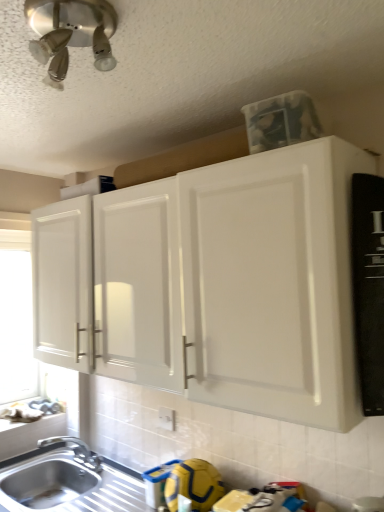
Describe the element at coordinates (166, 418) in the screenshot. The height and width of the screenshot is (512, 384). I see `white plastic electric outlet at lower center` at that location.

Where is `white matte window screen at left`? This screenshot has width=384, height=512. white matte window screen at left is located at coordinates (16, 320).

Find the location of `silver metallic faucet at lower left`. silver metallic faucet at lower left is located at coordinates (74, 449).

Image resolution: width=384 pixels, height=512 pixels. Describe the element at coordinates (212, 284) in the screenshot. I see `white matte cabinet at upper center` at that location.

Identify the location of white matte window sill at lower left. This screenshot has width=384, height=512. (36, 426).

Looking at this image, is white matte window sill at lower left oriented towards white matte window screen at left?

No, white matte window sill at lower left is not aimed at white matte window screen at left.

From the image's perspective, is white matte window sill at lower left on white matte window screen at left?

No, from the image's perspective, white matte window sill at lower left is not on top of white matte window screen at left.

How far apart are white matte window sill at lower left and white matte window screen at left?

32.33 inches.

Identify the location of window screen that appears on the left of white matte window sill at lower left. Image resolution: width=384 pixels, height=512 pixels. (16, 320).

From a real-world perspective, is white matte window sill at lower left over white plastic electric outlet at lower center?

No.

Are white matte window sill at lower left and white plastic electric outlet at lower center far apart?

white matte window sill at lower left is actually quite close to white plastic electric outlet at lower center.

Is stainless steel sink at lower left not near white plastic electric outlet at lower center?

No, there isn't a large distance between stainless steel sink at lower left and white plastic electric outlet at lower center.

Considering the sizes of objects stainless steel sink at lower left and white plastic electric outlet at lower center in the image provided, who is bigger, stainless steel sink at lower left or white plastic electric outlet at lower center?

stainless steel sink at lower left.

Could you tell me if stainless steel sink at lower left is turned towards white plastic electric outlet at lower center?

No, stainless steel sink at lower left is not facing towards white plastic electric outlet at lower center.

From the image's perspective, is stainless steel sink at lower left located above or below white plastic electric outlet at lower center?

From the image's perspective, stainless steel sink at lower left appears below white plastic electric outlet at lower center.

Which object is thinner, white matte window sill at lower left or silver metallic faucet at lower left?

white matte window sill at lower left.

Identify the location of window sill above the silver metallic faucet at lower left (from the image's perspective). Image resolution: width=384 pixels, height=512 pixels. (36, 426).

Could you tell me if white matte window sill at lower left is facing silver metallic faucet at lower left?

Yes, white matte window sill at lower left is facing silver metallic faucet at lower left.

Does white matte window sill at lower left appear on the right side of silver metallic faucet at lower left?

In fact, white matte window sill at lower left is to the left of silver metallic faucet at lower left.

Does satin nickel light fixture at upper left have a greater height compared to white matte window screen at left?

No, satin nickel light fixture at upper left is not taller than white matte window screen at left.

Between satin nickel light fixture at upper left and white matte window screen at left, which one has smaller width?

white matte window screen at left.

How different are the orientations of satin nickel light fixture at upper left and white matte window screen at left in degrees?

86.8 degrees separate the facing orientations of satin nickel light fixture at upper left and white matte window screen at left.

Is satin nickel light fixture at upper left spatially inside white matte window screen at left, or outside of it?

satin nickel light fixture at upper left is located beyond the bounds of white matte window screen at left.

Image resolution: width=384 pixels, height=512 pixels. I want to click on window screen positioned vertically above the silver metallic faucet at lower left (from a real-world perspective), so click(16, 320).

How far apart are silver metallic faucet at lower left and white matte window screen at left?

silver metallic faucet at lower left and white matte window screen at left are 38.85 inches apart from each other.

From the picture: Is silver metallic faucet at lower left to the right of white matte window screen at left from the viewer's perspective?

Yes, silver metallic faucet at lower left is to the right of white matte window screen at left.

In order to click on tap lying behind the stainless steel sink at lower left in this screenshot , I will do `click(74, 449)`.

Which point is more distant from viewer, (58, 439) or (78, 473)?

Positioned behind is point (58, 439).

In terms of height, does silver metallic faucet at lower left look taller or shorter compared to stainless steel sink at lower left?

In the image, silver metallic faucet at lower left appears to be shorter than stainless steel sink at lower left.

Where is `window sill that appears below the white matte window screen at left (from the image's perspective)`? window sill that appears below the white matte window screen at left (from the image's perspective) is located at coordinates (x=36, y=426).

In order to click on electric outlet in front of the white matte window sill at lower left in this screenshot , I will do `click(166, 418)`.

Considering their positions, is white matte window screen at left positioned closer to satin nickel light fixture at upper left than stainless steel sink at lower left?

stainless steel sink at lower left.

Considering their positions, is silver metallic faucet at lower left positioned closer to stainless steel sink at lower left than white matte cabinet at upper center?

Based on the image, silver metallic faucet at lower left appears to be nearer to stainless steel sink at lower left.

Consider the image. Which object lies further to the anchor point white matte cabinet at upper center, stainless steel sink at lower left or white plastic electric outlet at lower center?

stainless steel sink at lower left.

When comparing their distances from stainless steel sink at lower left, does satin nickel light fixture at upper left or white matte window sill at lower left seem closer?

Among the two, white matte window sill at lower left is located nearer to stainless steel sink at lower left.

Looking at the image, which one is located further to satin nickel light fixture at upper left, silver metallic faucet at lower left or white matte window sill at lower left?

silver metallic faucet at lower left is further to satin nickel light fixture at upper left.

Considering their positions, is white matte window sill at lower left positioned further to satin nickel light fixture at upper left than white matte window screen at left?

white matte window screen at left lies further to satin nickel light fixture at upper left than the other object.

Based on their spatial positions, is white matte cabinet at upper center or silver metallic faucet at lower left further from white matte window screen at left?

The object further to white matte window screen at left is white matte cabinet at upper center.

Estimate the real-world distances between objects in this image. Which object is further from white matte window sill at lower left, white matte cabinet at upper center or stainless steel sink at lower left?

Based on the image, white matte cabinet at upper center appears to be further to white matte window sill at lower left.

Locate an element on the screen. This screenshot has width=384, height=512. tap between satin nickel light fixture at upper left and stainless steel sink at lower left from top to bottom is located at coordinates (74, 449).

At what (x,y) coordinates should I click in order to perform the action: click on tap between white matte cabinet at upper center and stainless steel sink at lower left vertically. Please return your answer as a coordinate pair (x, y). Looking at the image, I should click on click(74, 449).

You are a GUI agent. You are given a task and a screenshot of the screen. Output one action in this format:
    pyautogui.click(x=<x>, y=<y>)
    Task: Click on the window sill between white matte cabinet at upper center and white matte window screen at left along the z-axis
    
    Given the screenshot: What is the action you would take?
    pyautogui.click(x=36, y=426)

Image resolution: width=384 pixels, height=512 pixels. I want to click on cabinetry positioned between satin nickel light fixture at upper left and white matte window sill at lower left from near to far, so click(x=212, y=284).